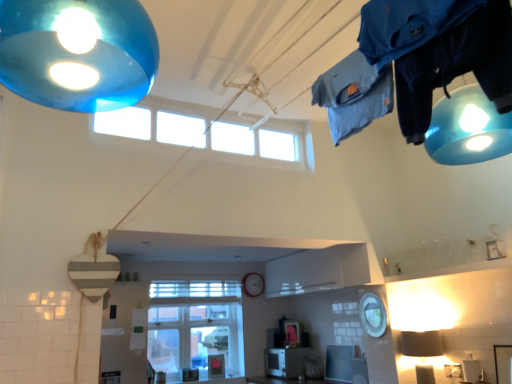
Question: Is matte white lampshade at lower right in front of or behind clear glass window at center, the 2th window positioned from the front, in the image?

Choices:
 (A) behind
 (B) front

Answer: (B)

Question: Is matte white lampshade at lower right inside the boundaries of clear glass window at center, which is the 1th window in bottom-to-top order, or outside?

Choices:
 (A) inside
 (B) outside

Answer: (B)

Question: Considering the real-world distances, which object is farthest from the clear glass window at center, the 2th window positioned from the front?

Choices:
 (A) metallic silver clock at center
 (B) satin silver toaster at center
 (C) matte white lampshade at lower right
 (D) transparent glass window at upper center, marked as the 1th window in a front-to-back arrangement

Answer: (C)

Question: Estimate the real-world distances between objects in this image. Which object is farther from the transparent glass window at upper center, acting as the second window starting from the bottom?

Choices:
 (A) metallic silver clock at center
 (B) satin silver toaster at center
 (C) clear glass window at center, which is the 1th window in bottom-to-top order
 (D) matte white lampshade at lower right

Answer: (B)